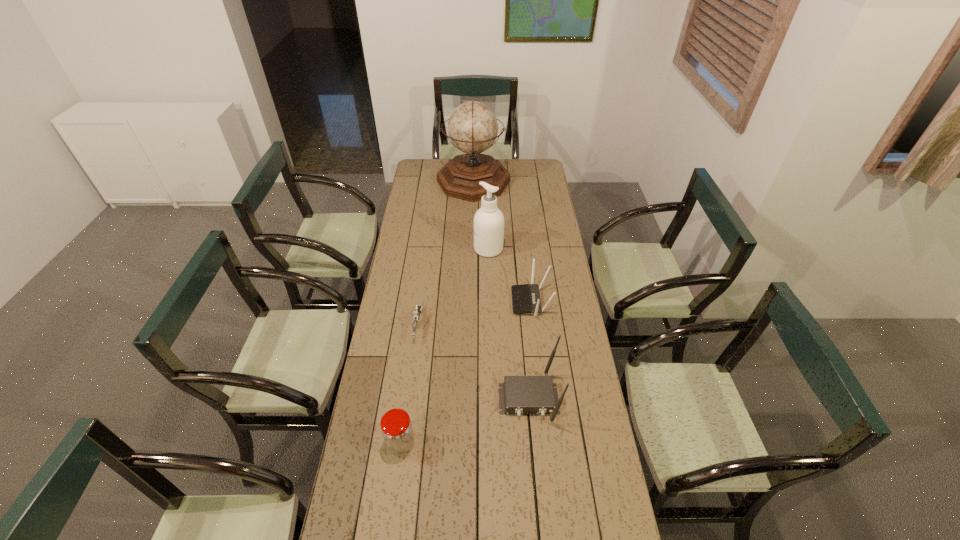
Image resolution: width=960 pixels, height=540 pixels. In order to click on globe at the left edge in this screenshot , I will do `click(472, 127)`.

Image resolution: width=960 pixels, height=540 pixels. In order to click on jar at the left edge in this screenshot , I will do `click(397, 431)`.

The width and height of the screenshot is (960, 540). Find the location of `gun at the left edge`. gun at the left edge is located at coordinates (416, 314).

The height and width of the screenshot is (540, 960). In order to click on object that is at the far left corner in this screenshot , I will do `click(472, 127)`.

Locate an element on the screen. free space at the far edge of the desktop is located at coordinates (510, 172).

Image resolution: width=960 pixels, height=540 pixels. Identify the location of free space at the left edge of the desktop. [410, 210].

Find the location of a particular element. This screenshot has width=960, height=540. vacant area at the right edge of the desktop is located at coordinates (583, 361).

Locate an element on the screen. This screenshot has height=540, width=960. free location at the far left corner of the desktop is located at coordinates (429, 171).

Identify the location of free space between the shorter router and the shortest object. (474, 314).

Image resolution: width=960 pixels, height=540 pixels. Identify the location of unoccupied position between the shortest object and the fifth farthest object. (473, 362).